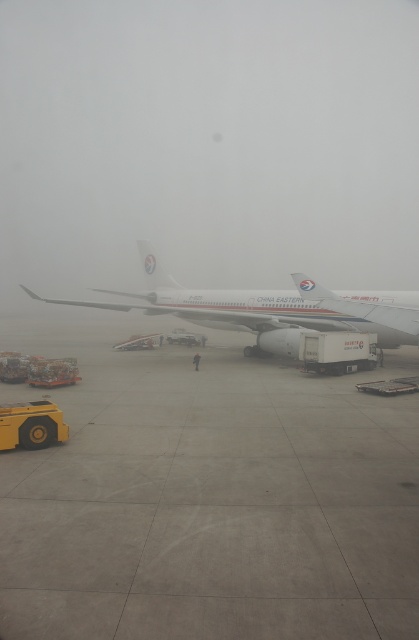
Does gray concrete runway at center appear under white matte airplane at center?

Yes.

Between gray concrete runway at center and white matte airplane at center, which one has more height?

white matte airplane at center

Where is `gray concrete runway at center`? The width and height of the screenshot is (419, 640). gray concrete runway at center is located at coordinates (209, 499).